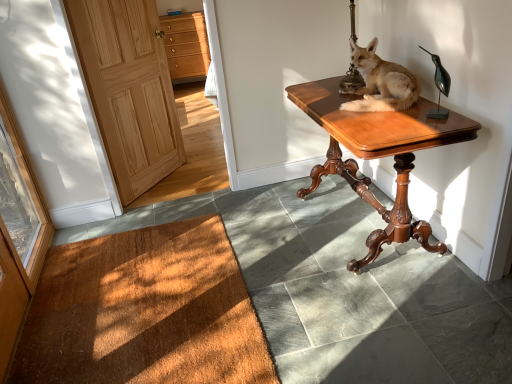
You are a GUI agent. You are given a task and a screenshot of the screen. Output one action in this format:
    pyautogui.click(x=<x>, y=<y>)
    Task: Click on the blank space to the left of mahogany wood desk at center
    This screenshot has height=384, width=512.
    Given the screenshot: What is the action you would take?
    tap(269, 233)